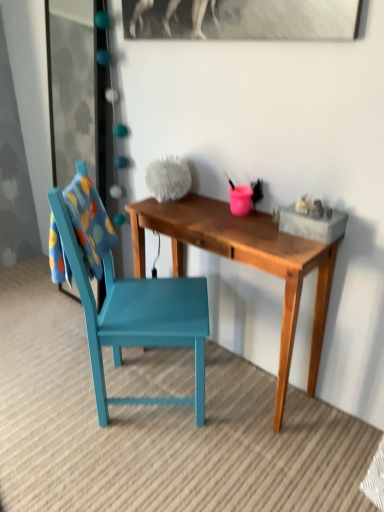
Locate an element on the screen. The width and height of the screenshot is (384, 512). free spot below teal painted wood chair at left (from a real-world perspective) is located at coordinates (145, 390).